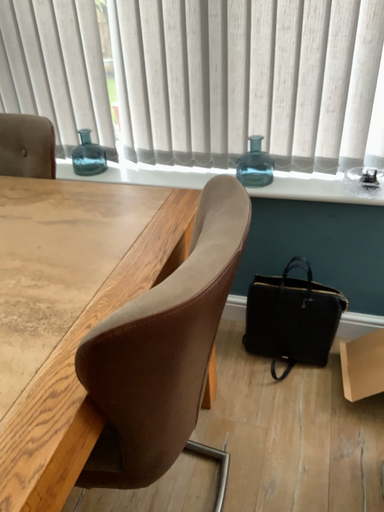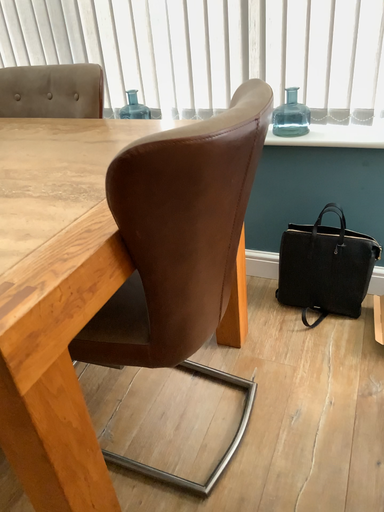
Question: Which way did the camera rotate in the video?

Choices:
 (A) rotated left
 (B) rotated right

Answer: (A)